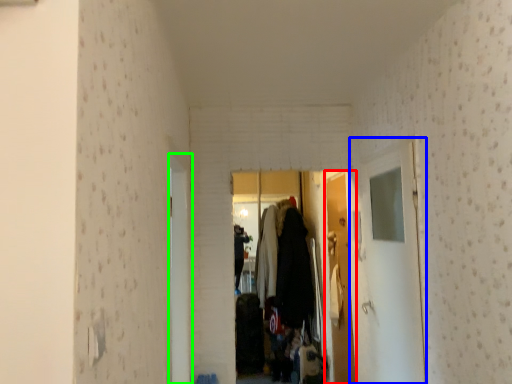
Question: Estimate the real-world distances between objects in this image. Which object is farther from door (highlighted by a red box), glass door (highlighted by a blue box) or door (highlighted by a green box)?

Choices:
 (A) glass door
 (B) door

Answer: (B)